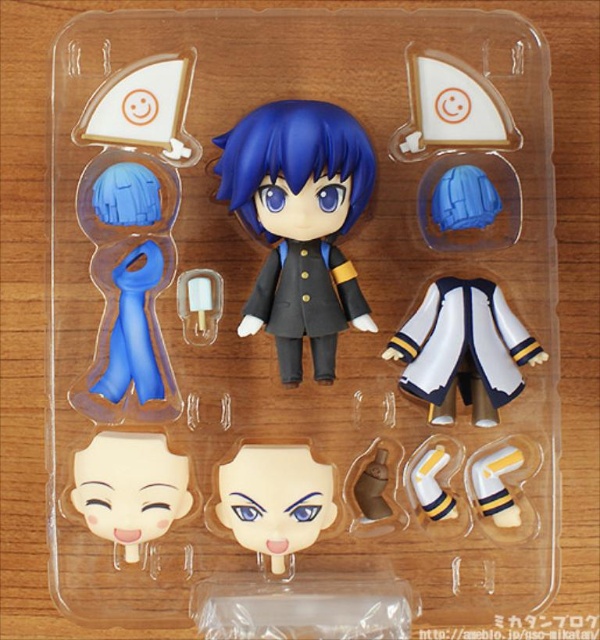
You are a collector who wants to display the matte black figure at center and the smooth beige face at center together. Since space is limited, you need to know which one takes up more space. Which object is larger?

The matte black figure at center is bigger than the smooth beige face at center, so the matte black figure at center takes up more space.

Based on the photo, you are holding the Nendoroid package and want to place it on a shelf. The shelf has a small indentation at point A and a larger one at point B. If point A corresponds to point (120, 230) and point B to (454, 330), which indentation is closer to you?

Point A at point (120, 230) is closer to you since it is further to the camera than point B at (454, 330).